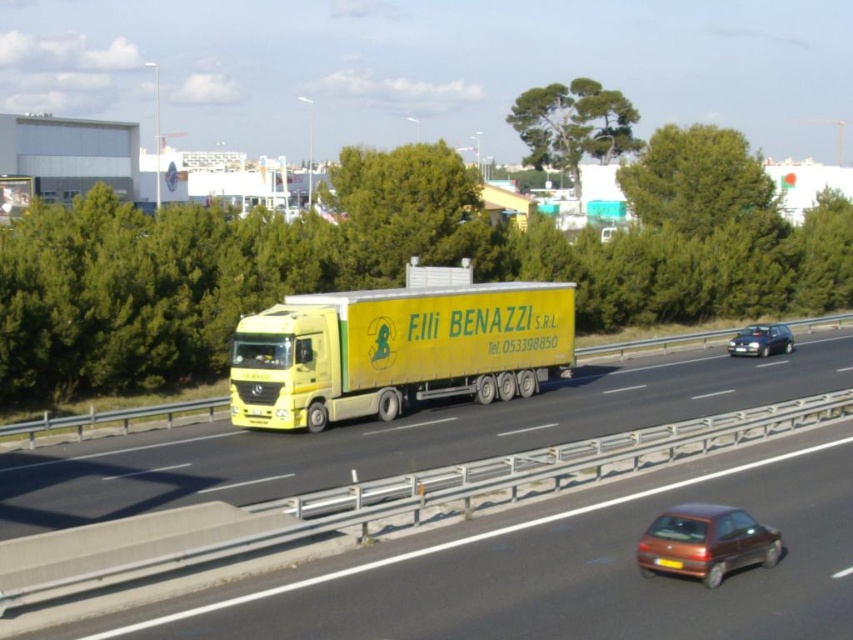
Between point (49, 460) and point (347, 384), which one is positioned in front?

Point (49, 460) is in front.

Which of these two, yellow matte truck at center or yellow matte trailer truck at center, stands taller?

With more height is yellow matte trailer truck at center.

Who is more forward, (x=134, y=468) or (x=485, y=378)?

Point (x=134, y=468)

What are the coordinates of `yellow matte truck at center` in the screenshot? It's located at (396, 436).

Can you confirm if metallic brown hatchback at lower right is positioned below metallic silver sedan at right?

Yes.

Between metallic brown hatchback at lower right and metallic silver sedan at right, which one is positioned lower?

metallic brown hatchback at lower right is lower down.

Find the location of a particular element. The image size is (853, 640). metallic brown hatchback at lower right is located at coordinates (706, 541).

Does point (689, 346) come in front of point (722, 576)?

No, it is behind (722, 576).

Who is shorter, yellow matte truck at center or metallic brown hatchback at lower right?

With less height is metallic brown hatchback at lower right.

Between point (509, 445) and point (677, 556), which one is positioned behind?

Positioned behind is point (509, 445).

This screenshot has height=640, width=853. In order to click on yellow matte truck at center in this screenshot , I will do `click(396, 436)`.